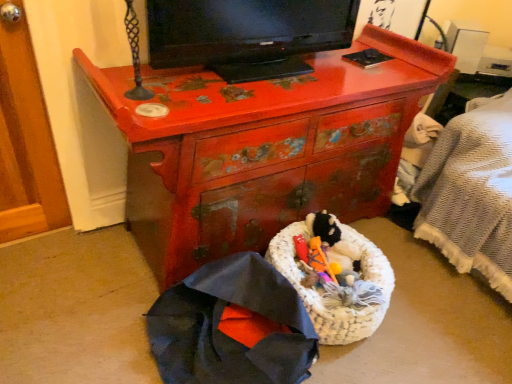
The image size is (512, 384). Identify the location of free location to the left of dark blue fabric umbrella at lower left. (94, 312).